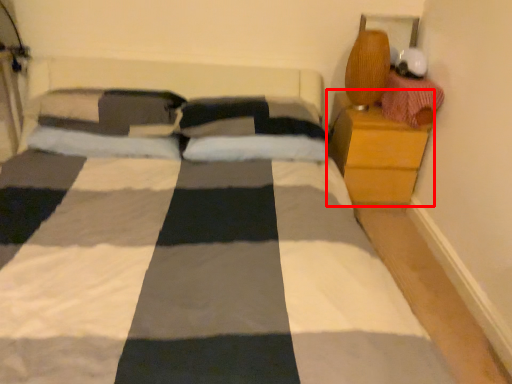
Question: From the image's perspective, where is nightstand (annotated by the red box) located in relation to material in the image?

Choices:
 (A) above
 (B) below

Answer: (B)